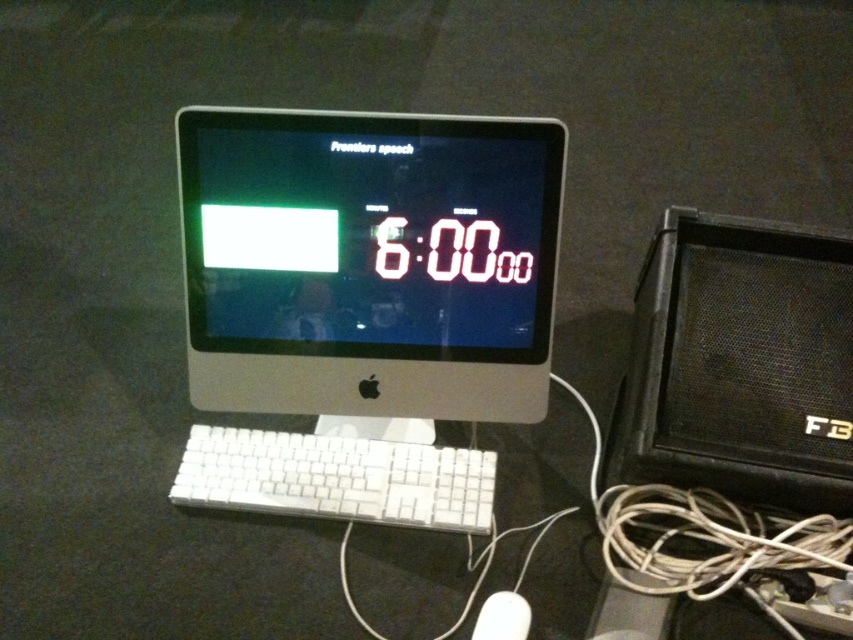
Question: Can you confirm if black textured speaker at right is thinner than white plastic mouse at lower center?

Choices:
 (A) yes
 (B) no

Answer: (B)

Question: Based on their relative distances, which object is nearer to the white plastic monitor at center?

Choices:
 (A) black textured speaker at right
 (B) white plastic mouse at lower center
 (C) white plastic keyboard at center

Answer: (C)

Question: Among these points, which one is nearest to the camera?

Choices:
 (A) (491, 611)
 (B) (294, 484)

Answer: (A)

Question: Can you confirm if white plastic monitor at center is wider than white plastic mouse at lower center?

Choices:
 (A) no
 (B) yes

Answer: (B)

Question: Does white plastic keyboard at center appear on the left side of white plastic mouse at lower center?

Choices:
 (A) yes
 (B) no

Answer: (A)

Question: Which point appears farthest from the camera in this image?

Choices:
 (A) (265, 150)
 (B) (495, 611)
 (C) (840, 362)
 (D) (235, 461)

Answer: (D)